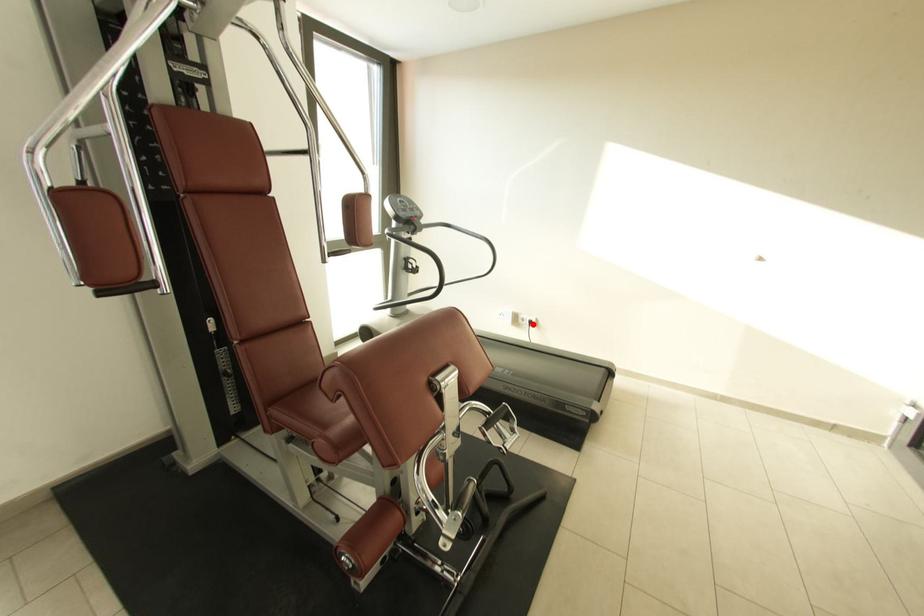
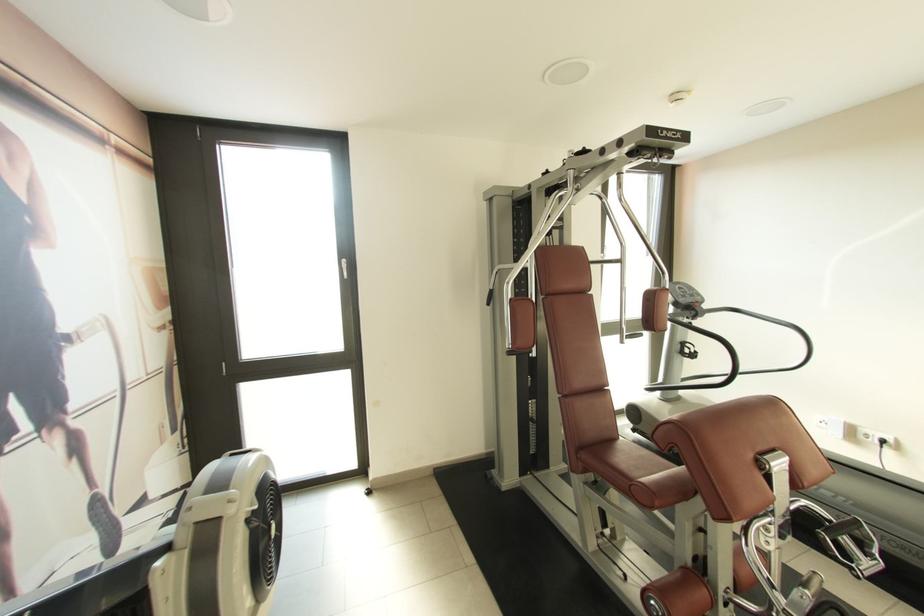
Where in the second image is the point corresponding to the highlighted location from the first image?

(882, 445)